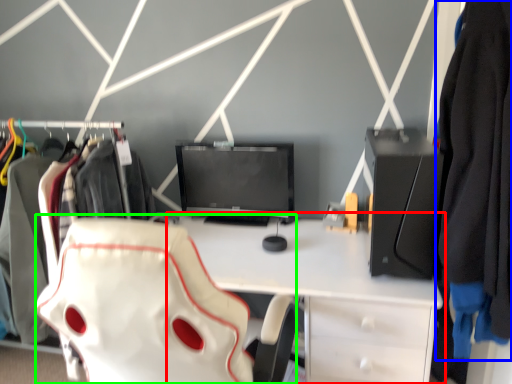
Question: Considering the real-world distances, which object is closest to desk (highlighted by a red box)? clothing (highlighted by a blue box) or swivel chair (highlighted by a green box).

Choices:
 (A) clothing
 (B) swivel chair

Answer: (B)